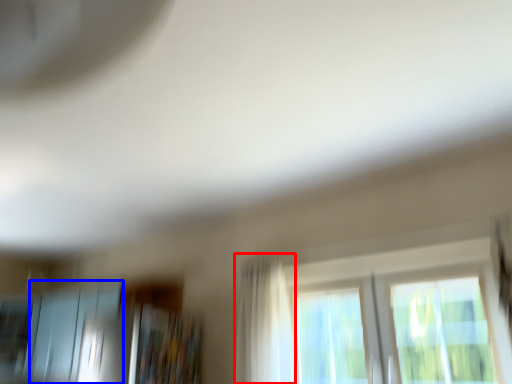
Question: Among these objects, which one is nearest to the camera, curtain (highlighted by a red box) or screen door (highlighted by a blue box)?

Choices:
 (A) curtain
 (B) screen door

Answer: (A)